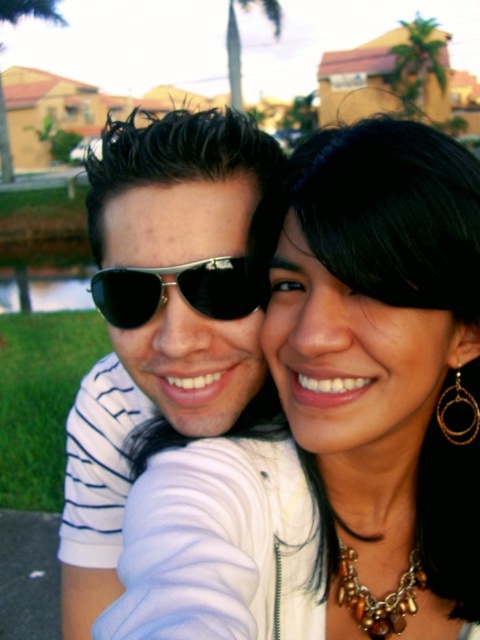
Question: Which of the following is the farthest from the observer?

Choices:
 (A) (223, 312)
 (B) (477, 401)
 (C) (110, 432)

Answer: (C)

Question: Can you confirm if white fabric at center is positioned below matte black sunglasses at center?

Choices:
 (A) yes
 (B) no

Answer: (A)

Question: Which of the following is the farthest from the observer?

Choices:
 (A) (206, 460)
 (B) (140, 272)

Answer: (A)

Question: Is white fabric at center thinner than metallic aviator sunglasses at center?

Choices:
 (A) yes
 (B) no

Answer: (B)

Question: Is white fabric at center above matte black sunglasses at center?

Choices:
 (A) yes
 (B) no

Answer: (B)

Question: Estimate the real-world distances between objects in this image. Which object is farther from the white fabric at center?

Choices:
 (A) matte black sunglasses at center
 (B) metallic aviator sunglasses at center

Answer: (B)